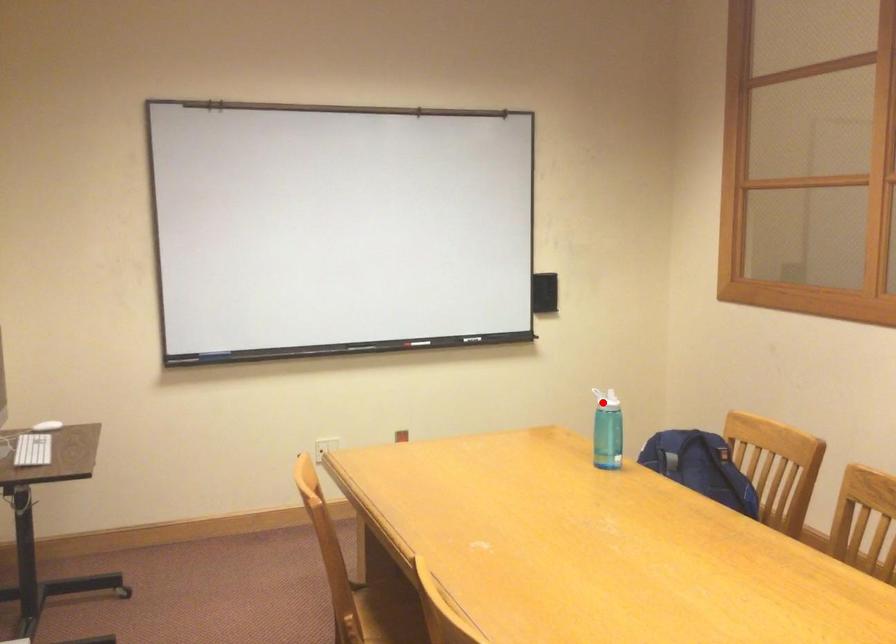
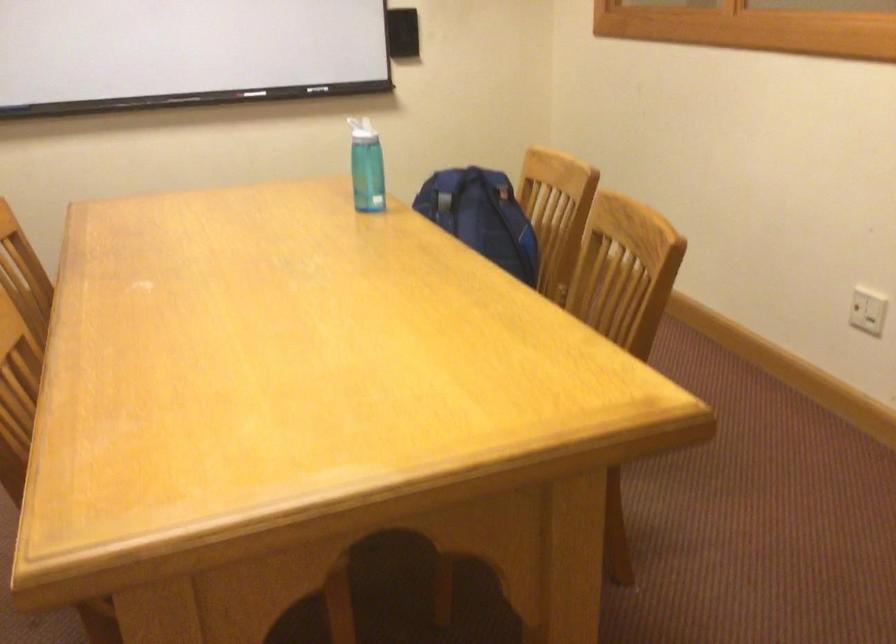
In the second image, find the point that corresponds to the highlighted location in the first image.

(362, 129)